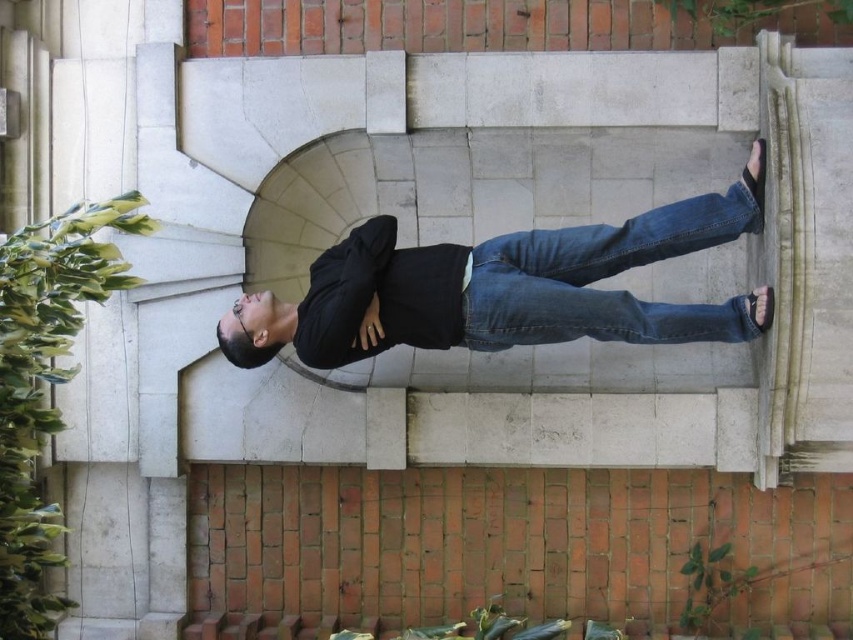
Based on the scene described, which object, the black matte shirt at center or the denim at center, has a greater width when viewed from the observer standing in front of the stone archway?

The black matte shirt at center might be wider than denim at center according to the description.